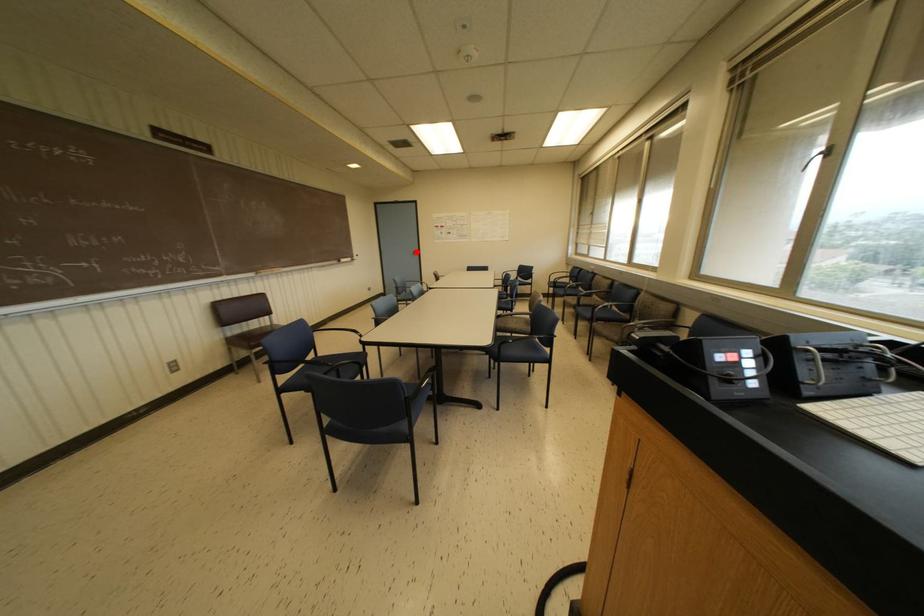
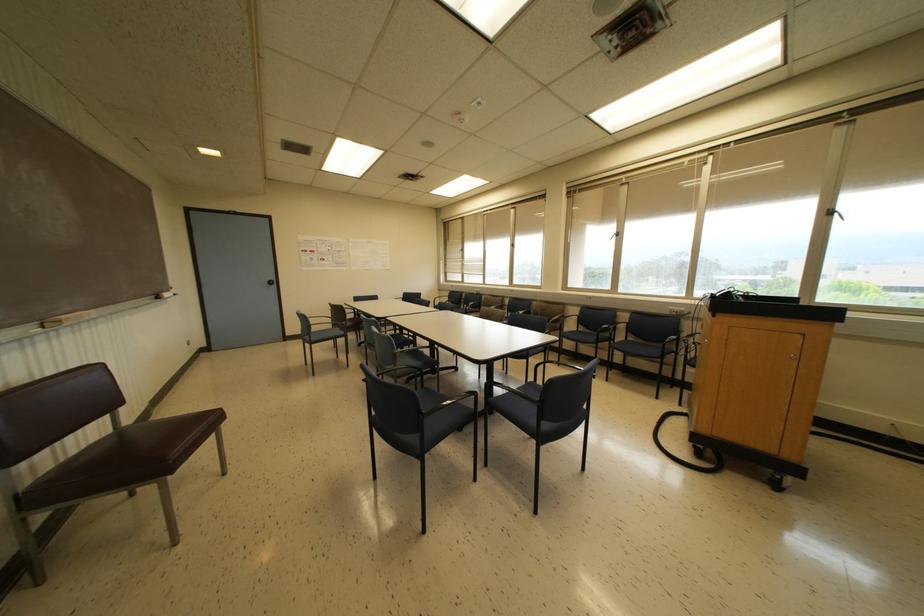
Question: A red point is marked in image1. In image2, is the corresponding 3D point closer to the camera or farther? Reply with the corresponding letter.

Choices:
 (A) The corresponding 3D point is closer.
 (B) The corresponding 3D point is farther.

Answer: (B)